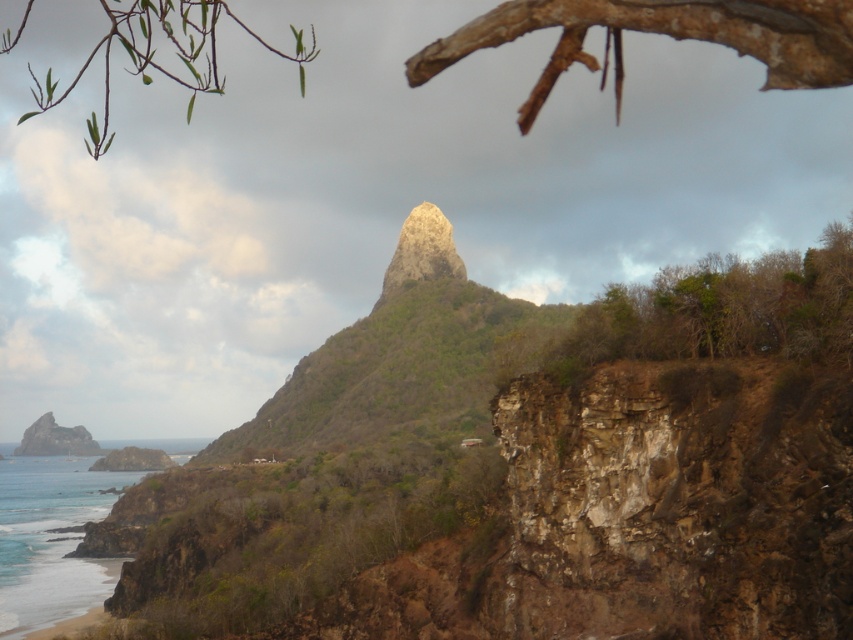
Question: Is blue water at lower left to the left of rusty metallic rock at lower left from the viewer's perspective?

Choices:
 (A) no
 (B) yes

Answer: (A)

Question: Does blue water at lower left come in front of rusty metallic rock at lower left?

Choices:
 (A) yes
 (B) no

Answer: (A)

Question: Which point is closer to the camera?

Choices:
 (A) (19, 525)
 (B) (71, 440)

Answer: (A)

Question: Is blue water at lower left smaller than rusty metallic rock at lower left?

Choices:
 (A) yes
 (B) no

Answer: (B)

Question: Which point is closer to the camera?

Choices:
 (A) blue water at lower left
 (B) rusty metallic rock at lower left

Answer: (A)